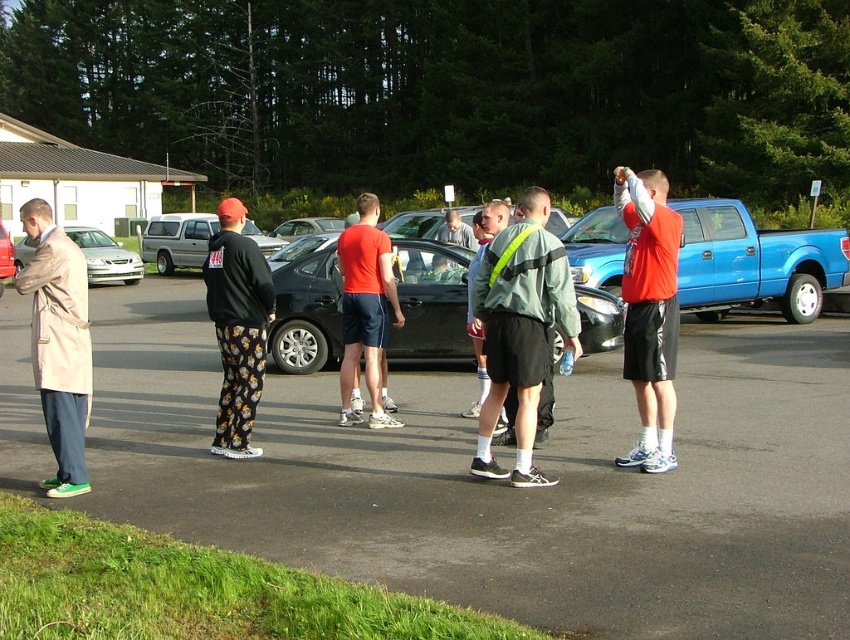
Is point (571, 227) positioned after point (319, 230)?

No, it is in front of (319, 230).

Which is more to the left, blue matte truck at right or shiny black sedan at center?

shiny black sedan at center

Which is behind, point (800, 317) or point (289, 224)?

Positioned behind is point (289, 224).

You are a GUI agent. You are given a task and a screenshot of the screen. Output one action in this format:
    pyautogui.click(x=<x>, y=<y>)
    Task: Click on the blue matte truck at right
    The height and width of the screenshot is (640, 850).
    Given the screenshot: What is the action you would take?
    pyautogui.click(x=754, y=260)

Does beige coat at left lie behind matte red shirt at center?

No, beige coat at left is in front of matte red shirt at center.

This screenshot has width=850, height=640. Find the location of `beige coat at left`. beige coat at left is located at coordinates (58, 342).

Is point (656, 214) positioned after point (94, 266)?

That is False.

Is red matte shorts at right taller than silver metallic sedan at center?

No.

Is point (622, 278) in front of point (123, 250)?

Yes, point (622, 278) is closer to viewer.

Locate an element on the screen. The image size is (850, 640). red matte shorts at right is located at coordinates (649, 310).